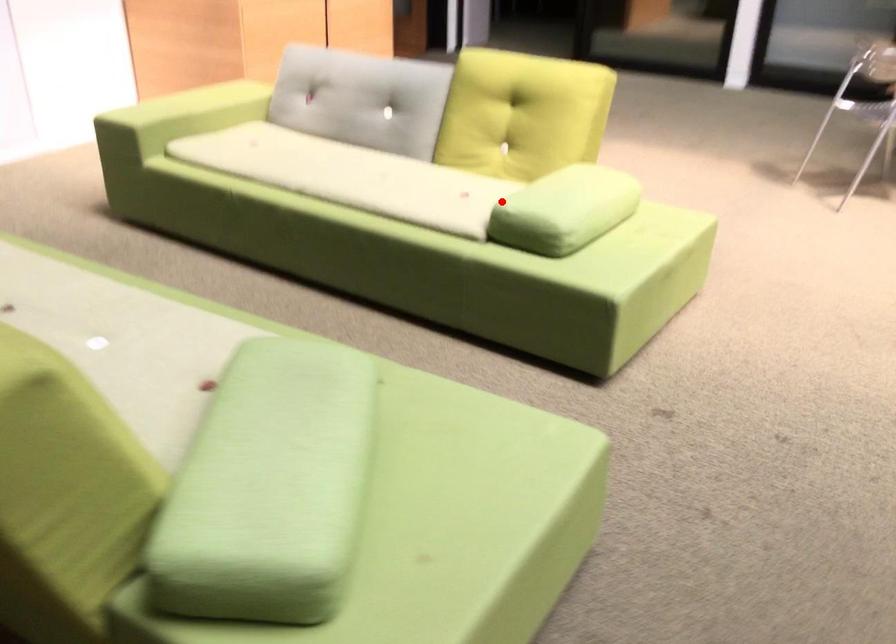
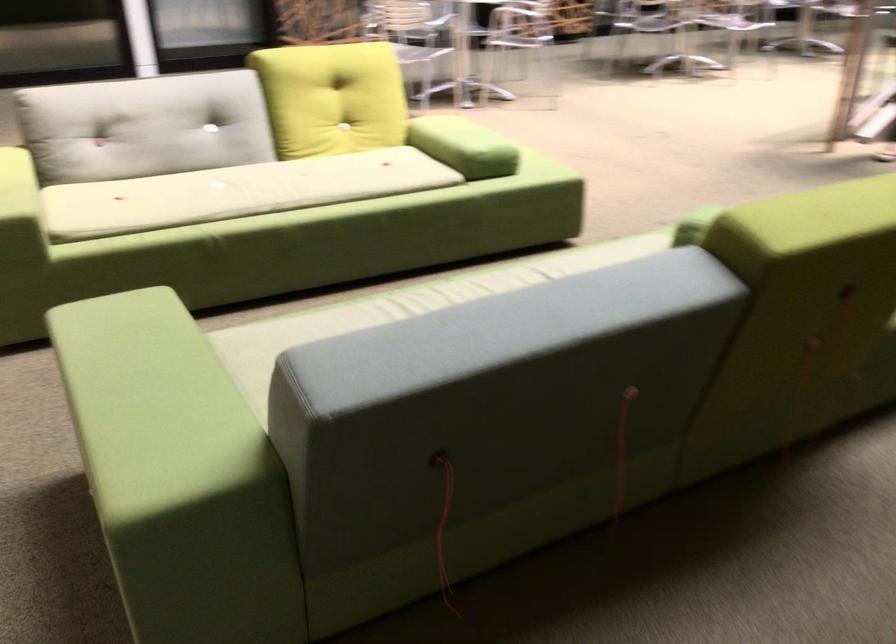
Question: I am providing you with two images of the same scene from different viewpoints. A red point is marked on the first image. Is the red point's position out of view in image 2?

Choices:
 (A) Yes
 (B) No

Answer: (B)